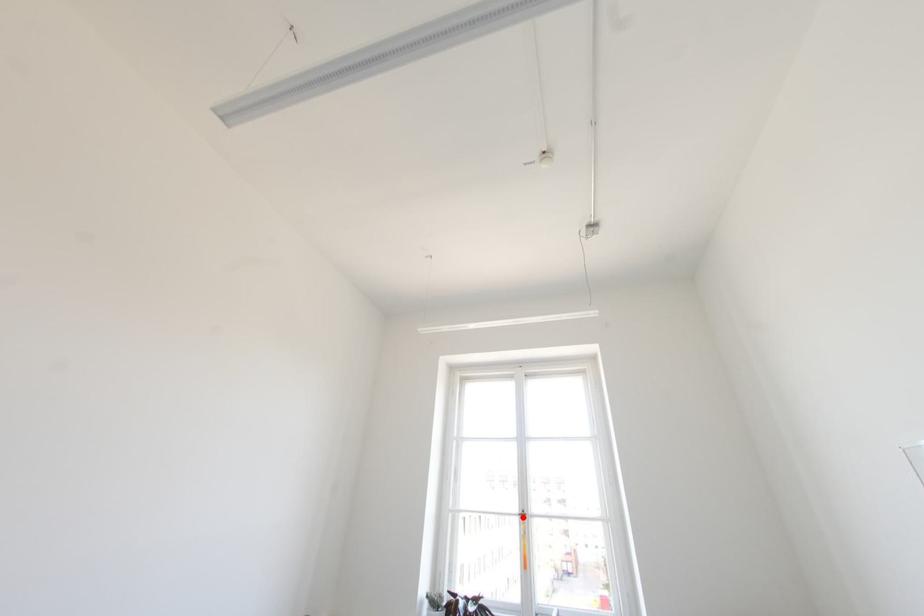
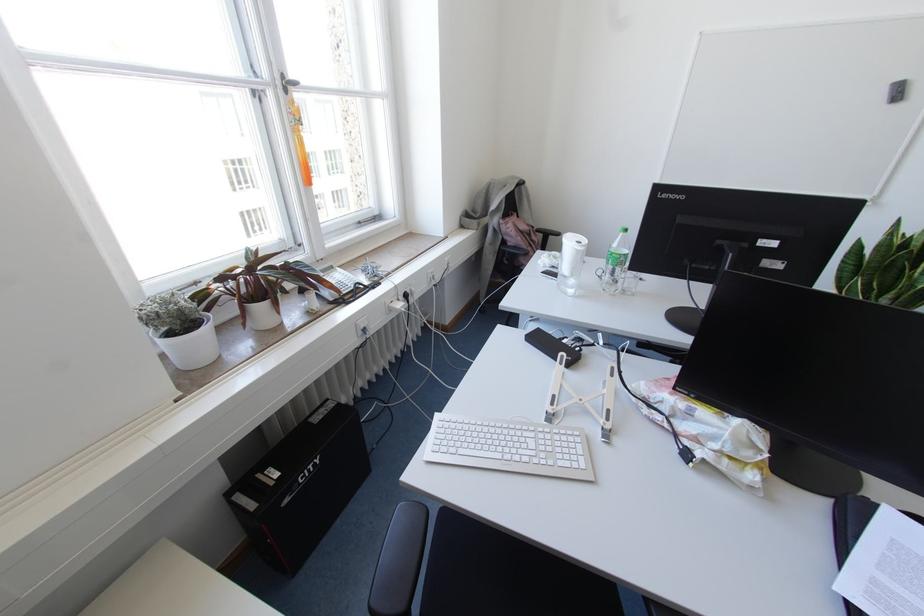
Where in the second image is the point corresponding to the highlighted location from the first image?

(285, 90)